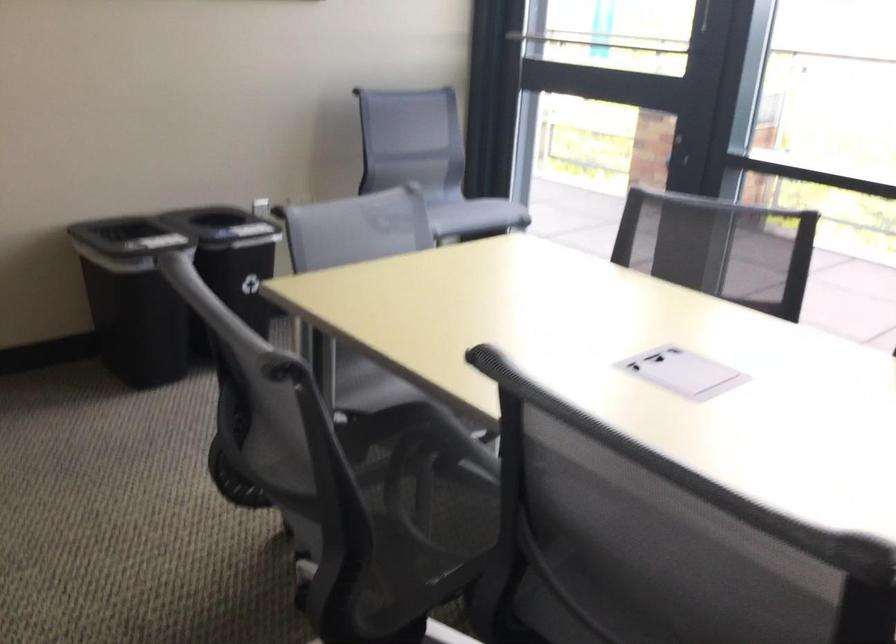
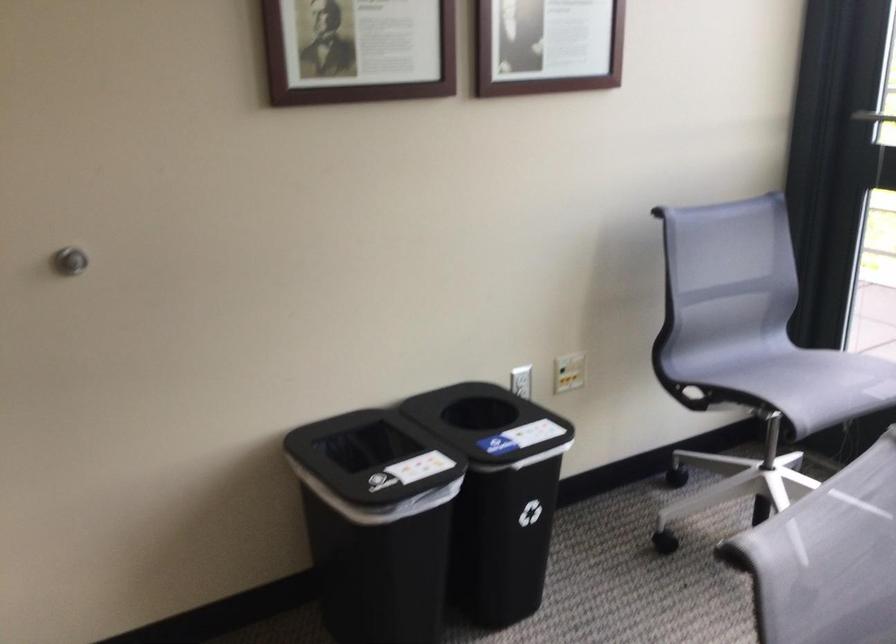
The images are taken continuously from a first-person perspective. In which direction are you moving?

The movement direction of the cameraman is left, forward.